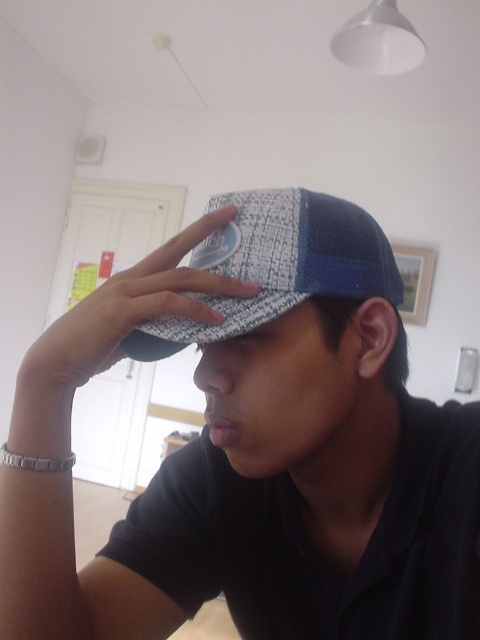
You are a photographer setting up a shoot in the room. You need to position a light source to the left of the woven fabric cap at center and to the right of the blue mesh cap at center. Is this possible given their current positions?

The woven fabric cap at center is to the left of the blue mesh cap at center, meaning there is no space between them for the light source to be placed to the left of the woven fabric cap at center and to the right of the blue mesh cap at center simultaneously. Therefore, this positioning is not possible.

You are trying to decide which cap to wear based on their widths. Given the blue mesh cap at center and the white textured cap at center, which one is wider?

The blue mesh cap at center is wider than the white textured cap at center according to the description.

You are trying to decide which cap to wear based on their heights. The blue mesh cap at center and the white textured cap at center are both in front of you. Which one is shorter?

The blue mesh cap at center is shorter than the white textured cap at center.